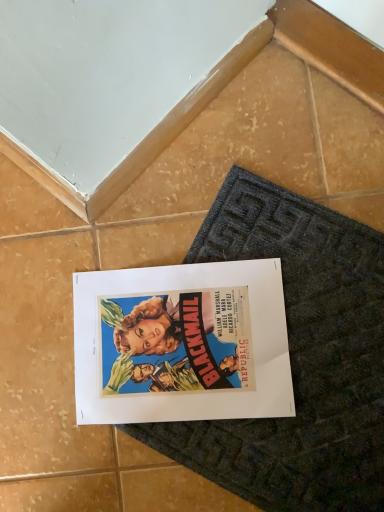
In order to click on dark gray textured bath mat at center in this screenshot , I will do `click(298, 358)`.

Describe the element at coordinates (298, 358) in the screenshot. The height and width of the screenshot is (512, 384). I see `dark gray textured bath mat at center` at that location.

What do you see at coordinates (181, 343) in the screenshot?
I see `matte paper poster at center` at bounding box center [181, 343].

Locate an element on the screen. This screenshot has height=512, width=384. matte paper poster at center is located at coordinates (181, 343).

Where is `dark gray textured bath mat at center`? Image resolution: width=384 pixels, height=512 pixels. dark gray textured bath mat at center is located at coordinates (298, 358).

Considering the relative positions of matte paper poster at center and dark gray textured bath mat at center in the image provided, is matte paper poster at center to the right of dark gray textured bath mat at center from the viewer's perspective?

In fact, matte paper poster at center is to the left of dark gray textured bath mat at center.

Between matte paper poster at center and dark gray textured bath mat at center, which one is positioned in front?

dark gray textured bath mat at center.

Is point (228, 283) less distant than point (296, 451)?

No, it is behind (296, 451).

From the image's perspective, who appears lower, matte paper poster at center or dark gray textured bath mat at center?

From the image's view, dark gray textured bath mat at center is below.

From a real-world perspective, does matte paper poster at center stand above dark gray textured bath mat at center?

Indeed, from a real-world perspective, matte paper poster at center stands above dark gray textured bath mat at center.

Between matte paper poster at center and dark gray textured bath mat at center, which one has larger width?

Wider between the two is dark gray textured bath mat at center.

Who is shorter, matte paper poster at center or dark gray textured bath mat at center?

dark gray textured bath mat at center is shorter.

Is matte paper poster at center bigger or smaller than dark gray textured bath mat at center?

matte paper poster at center is smaller than dark gray textured bath mat at center.

Is matte paper poster at center positioned beyond the bounds of dark gray textured bath mat at center?

No, matte paper poster at center is inside dark gray textured bath mat at center's boundary.

Are matte paper poster at center and dark gray textured bath mat at center far apart?

matte paper poster at center is actually quite close to dark gray textured bath mat at center.

Is matte paper poster at center looking in the opposite direction of dark gray textured bath mat at center?

Yes, matte paper poster at center is facing away from dark gray textured bath mat at center.

I want to click on poster on the left side of dark gray textured bath mat at center, so click(x=181, y=343).

Is dark gray textured bath mat at center to the left of matte paper poster at center from the viewer's perspective?

In fact, dark gray textured bath mat at center is to the right of matte paper poster at center.

Is the position of dark gray textured bath mat at center less distant than that of matte paper poster at center?

Yes, dark gray textured bath mat at center is in front of matte paper poster at center.

Which is closer to the camera, (322, 370) or (82, 295)?

Point (322, 370)

From the image's perspective, is dark gray textured bath mat at center below matte paper poster at center?

Yes, from the image's perspective, dark gray textured bath mat at center is beneath matte paper poster at center.

From a real-world perspective, which object rests below the other?

dark gray textured bath mat at center, from a real-world perspective.

Considering the relative sizes of dark gray textured bath mat at center and matte paper poster at center in the image provided, is dark gray textured bath mat at center thinner than matte paper poster at center?

No.

From their relative heights in the image, would you say dark gray textured bath mat at center is taller or shorter than matte paper poster at center?

Clearly, dark gray textured bath mat at center is shorter compared to matte paper poster at center.

Can you confirm if dark gray textured bath mat at center is bigger than matte paper poster at center?

Indeed, dark gray textured bath mat at center has a larger size compared to matte paper poster at center.

Is dark gray textured bath mat at center located outside matte paper poster at center?

Yes, dark gray textured bath mat at center is located beyond the bounds of matte paper poster at center.

Are dark gray textured bath mat at center and matte paper poster at center far apart?

dark gray textured bath mat at center is near matte paper poster at center, not far away.

Is dark gray textured bath mat at center aimed at matte paper poster at center?

Yes, dark gray textured bath mat at center faces towards matte paper poster at center.

Where is `bath mat on the right side of matte paper poster at center`? This screenshot has height=512, width=384. bath mat on the right side of matte paper poster at center is located at coordinates point(298,358).

Where is `bath mat below the matte paper poster at center (from a real-world perspective)`? The image size is (384, 512). bath mat below the matte paper poster at center (from a real-world perspective) is located at coordinates (298, 358).

The height and width of the screenshot is (512, 384). What are the coordinates of `bath mat below the matte paper poster at center (from the image's perspective)` in the screenshot? It's located at (298, 358).